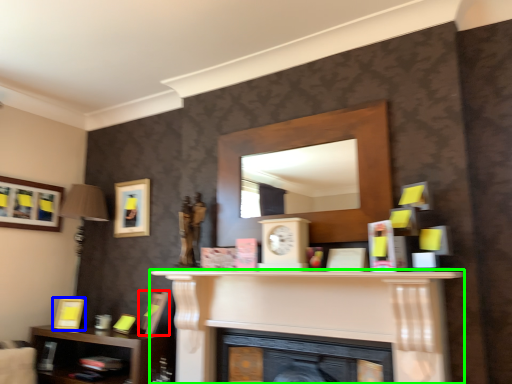
Question: Estimate the real-world distances between objects in this image. Which object is closer to picture frame (highlighted by a red box), picture frame (highlighted by a blue box) or fireplace (highlighted by a green box)?

Choices:
 (A) picture frame
 (B) fireplace

Answer: (A)